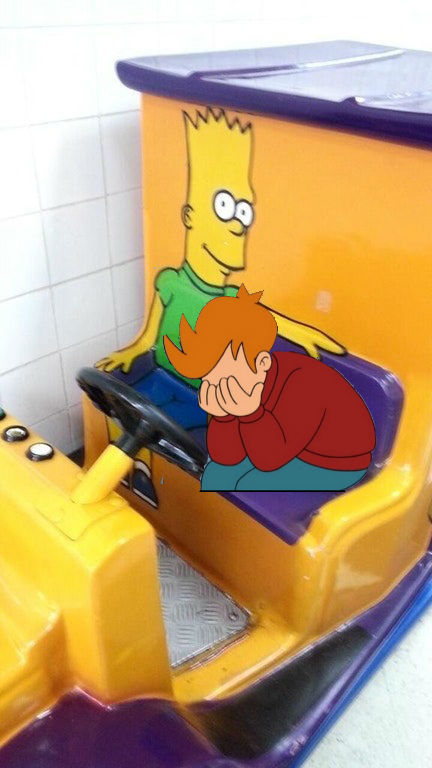
You are a GUI agent. You are given a task and a screenshot of the screen. Output one action in this format:
    pyautogui.click(x=<x>, y=<y>)
    Task: Click on the white tiles
    
    Given the screenshot: What is the action you would take?
    pyautogui.click(x=49, y=104)